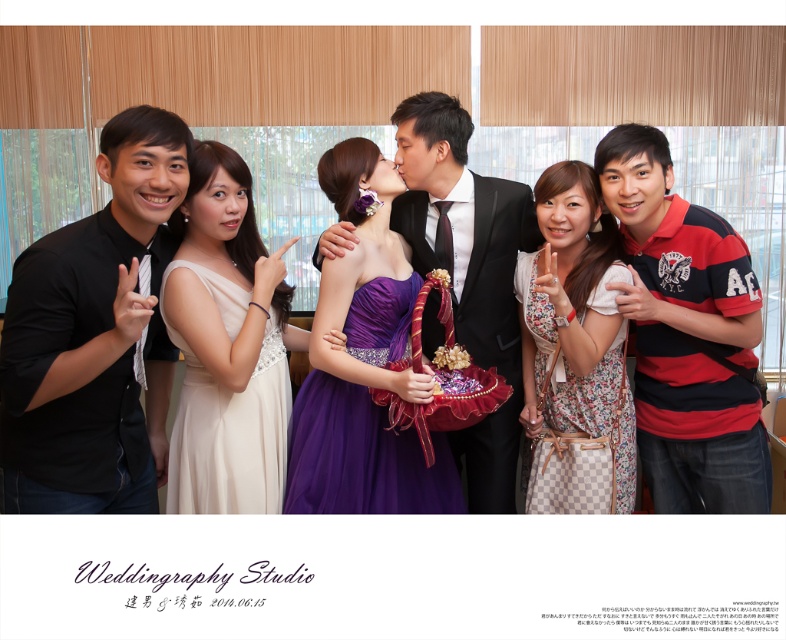
Question: Is black satin suit at center in front of floral cotton dress at center?

Choices:
 (A) no
 (B) yes

Answer: (A)

Question: Is red striped polo shirt at right bigger than purple satin dress at center?

Choices:
 (A) no
 (B) yes

Answer: (B)

Question: Which object appears closest to the camera in this image?

Choices:
 (A) black matte shirt at left
 (B) floral cotton dress at center
 (C) black satin suit at center
 (D) red striped polo shirt at right

Answer: (A)

Question: Can you confirm if black matte shirt at left is positioned above purple satin dress at center?

Choices:
 (A) yes
 (B) no

Answer: (A)

Question: Which point is closer to the camera?

Choices:
 (A) (237, 301)
 (B) (399, 298)
 (C) (649, 125)
 (D) (472, 198)

Answer: (A)

Question: Estimate the real-world distances between objects in this image. Which object is farther from the floral cotton dress at center?

Choices:
 (A) black matte shirt at left
 (B) red striped polo shirt at right
 (C) purple satin dress at center
 (D) ivory satin dress at center

Answer: (A)